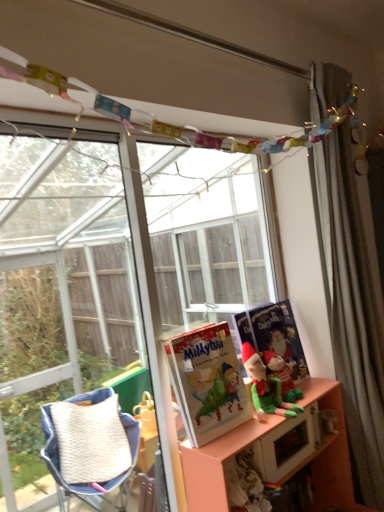
Question: From a real-world perspective, is green fabric elf at center below pink matte shelf at lower right?

Choices:
 (A) yes
 (B) no

Answer: (B)

Question: Is green fabric elf at center positioned beyond the bounds of pink matte shelf at lower right?

Choices:
 (A) no
 (B) yes

Answer: (B)

Question: Can you confirm if green fabric elf at center is positioned to the right of pink matte shelf at lower right?

Choices:
 (A) no
 (B) yes

Answer: (A)

Question: Is green fabric elf at center looking in the opposite direction of pink matte shelf at lower right?

Choices:
 (A) yes
 (B) no

Answer: (B)

Question: Does green fabric elf at center come behind pink matte shelf at lower right?

Choices:
 (A) yes
 (B) no

Answer: (A)

Question: Is silky gray curtain at right spatially inside pink matte shelf at lower right, or outside of it?

Choices:
 (A) inside
 (B) outside

Answer: (B)

Question: Visually, is silky gray curtain at right positioned to the left or to the right of pink matte shelf at lower right?

Choices:
 (A) left
 (B) right

Answer: (B)

Question: In terms of height, does silky gray curtain at right look taller or shorter compared to pink matte shelf at lower right?

Choices:
 (A) short
 (B) tall

Answer: (B)

Question: Does point (377, 358) appear closer or farther from the camera than point (289, 434)?

Choices:
 (A) farther
 (B) closer

Answer: (A)

Question: Does point (291, 327) appear closer or farther from the camera than point (372, 406)?

Choices:
 (A) closer
 (B) farther

Answer: (B)

Question: In the image, is matte blue paperback book at right on the left side or the right side of silky gray curtain at right?

Choices:
 (A) right
 (B) left

Answer: (B)

Question: Looking at the image, does matte blue paperback book at right seem bigger or smaller compared to silky gray curtain at right?

Choices:
 (A) big
 (B) small

Answer: (B)

Question: Looking at their shapes, would you say matte blue paperback book at right is wider or thinner than silky gray curtain at right?

Choices:
 (A) thin
 (B) wide

Answer: (A)

Question: Is matte paper book at center taller or shorter than matte blue paperback book at right?

Choices:
 (A) short
 (B) tall

Answer: (A)

Question: Which is correct: matte paper book at center is inside matte blue paperback book at right, or outside of it?

Choices:
 (A) outside
 (B) inside

Answer: (A)